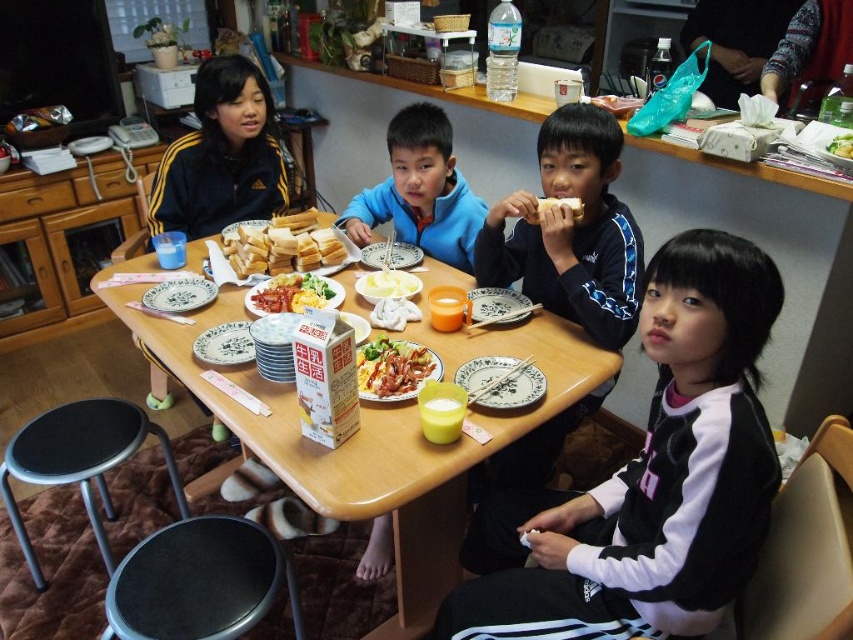
Question: Which object is the farthest from the green leafy vegetable at center?

Choices:
 (A) yellow scrambled eggs at center
 (B) black plastic stool at lower left
 (C) white bread at center
 (D) white bread at upper center

Answer: (B)

Question: Can you confirm if black rubber stool at lower left is wider than shiny plastic bacon at center?

Choices:
 (A) no
 (B) yes

Answer: (B)

Question: Does black rubber stool at lower left have a smaller size compared to yellow creamy mashed potatoes at center?

Choices:
 (A) no
 (B) yes

Answer: (A)

Question: Which object is positioned farthest from the yellow scrambled eggs at center?

Choices:
 (A) black rubber stool at lower left
 (B) green leafy vegetable at center
 (C) shiny plastic bacon at center
 (D) blue fleece jacket at center

Answer: (B)

Question: From the image, what is the correct spatial relationship of shiny plastic bacon at center in relation to white bread at upper center?

Choices:
 (A) above
 (B) below

Answer: (B)

Question: Which point is closer to the camera taking this photo?

Choices:
 (A) (296, 298)
 (B) (326, 243)
 (C) (367, 387)

Answer: (C)